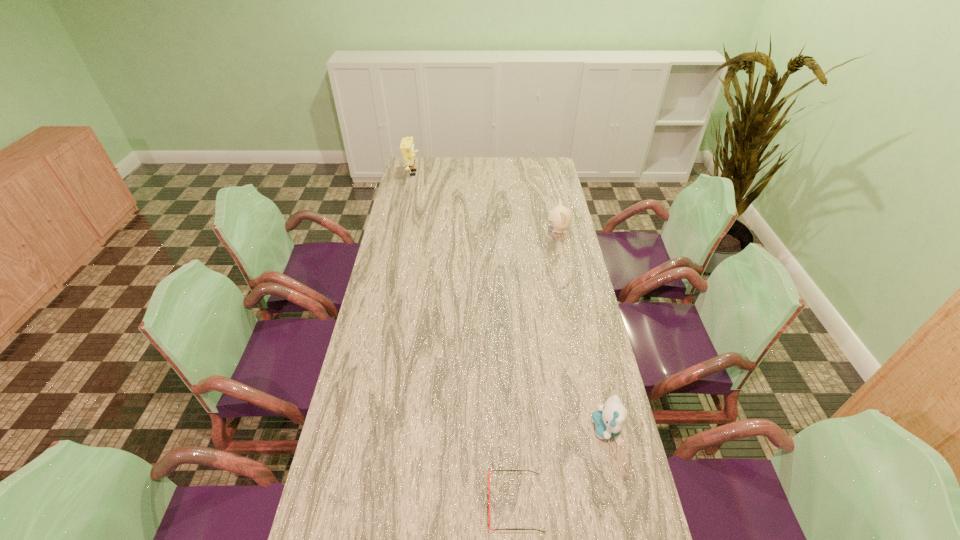
Image resolution: width=960 pixels, height=540 pixels. I want to click on vacant space located on the face of the second nearest object, so click(x=517, y=429).

Locate an element on the screen. free space located 0.210m on the face of the second nearest object is located at coordinates click(517, 429).

Where is `vacant space located on the face of the second nearest object`? vacant space located on the face of the second nearest object is located at coordinates (567, 429).

At what (x,y) coordinates should I click in order to perform the action: click on vacant space located 0.230m on the front-facing side of the nearest object. Please return your answer as a coordinate pair (x, y). Looking at the image, I should click on [396, 503].

You are a GUI agent. You are given a task and a screenshot of the screen. Output one action in this format:
    pyautogui.click(x=<x>, y=<y>)
    Task: Click on the vacant space located on the front-facing side of the nearest object
    The width and height of the screenshot is (960, 540).
    Given the screenshot: What is the action you would take?
    pyautogui.click(x=356, y=503)

At what (x,y) coordinates should I click in order to perform the action: click on vacant region located 0.200m on the front-facing side of the nearest object. Please return your answer as a coordinate pair (x, y). This screenshot has width=960, height=540. Looking at the image, I should click on (409, 503).

Find the location of a particular element. Image resolution: width=960 pixels, height=540 pixels. object at the far edge is located at coordinates point(407,148).

Locate an element on the screen. object present at the left edge is located at coordinates (407, 148).

Where is `object present at the far left corner`? object present at the far left corner is located at coordinates (407, 148).

Find the location of a particular element. vacant space at the far edge is located at coordinates (470, 173).